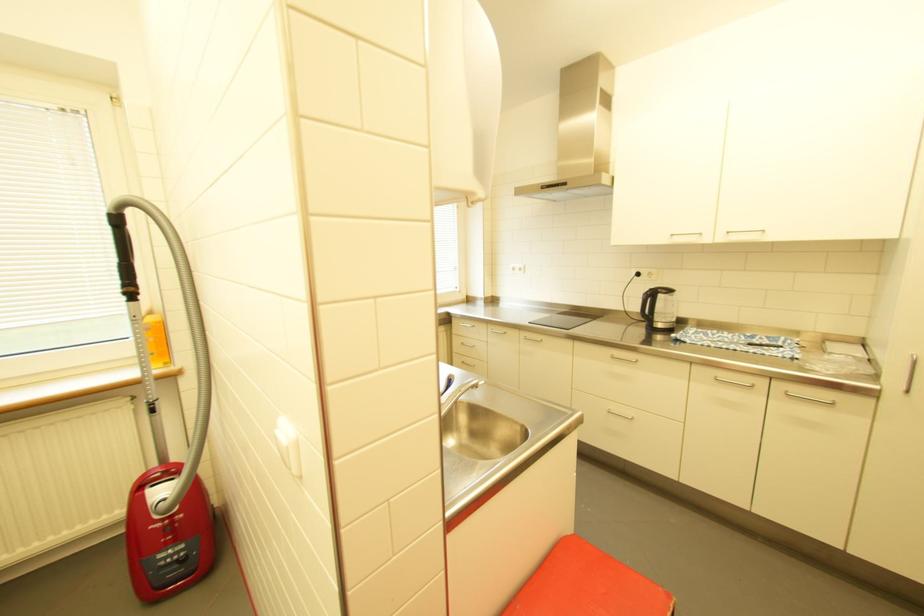
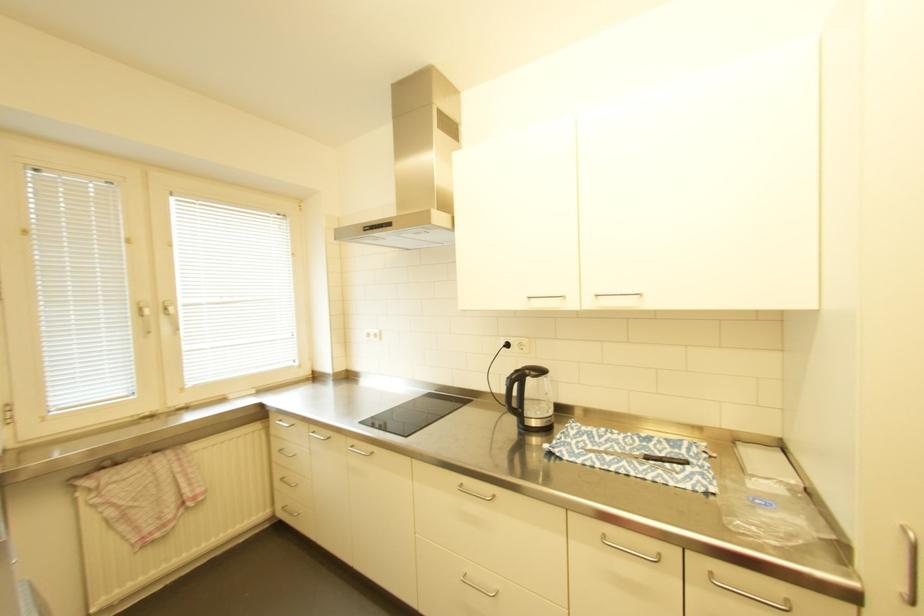
Where in the second image is the point corresponding to point (469, 344) from the first image?

(287, 451)